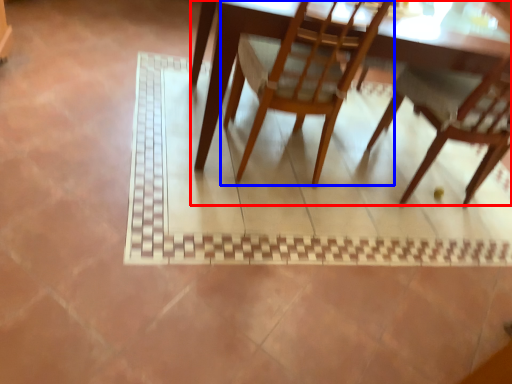
Question: Among these objects, which one is farthest to the camera, table (highlighted by a red box) or chair (highlighted by a blue box)?

Choices:
 (A) table
 (B) chair

Answer: (A)